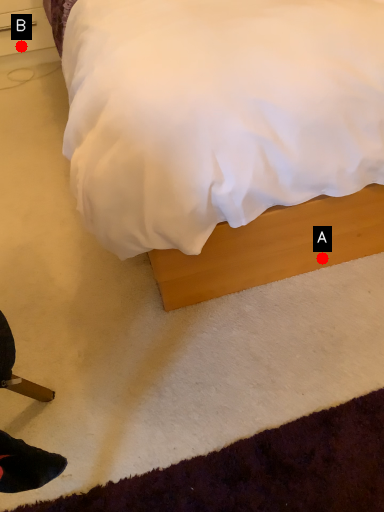
Question: Two points are circled on the image, labeled by A and B beside each circle. Among these points, which one is nearest to the camera?

Choices:
 (A) A is closer
 (B) B is closer

Answer: (A)